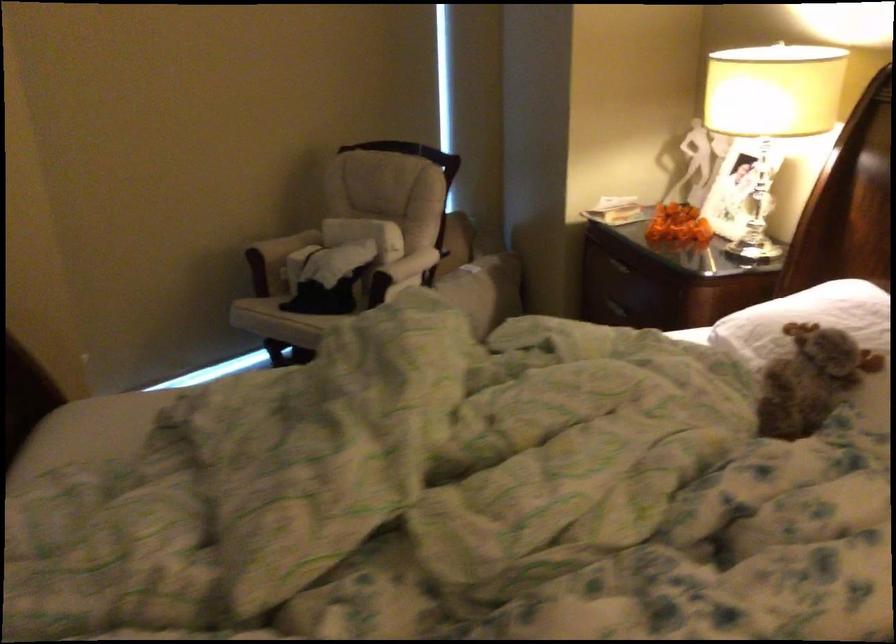
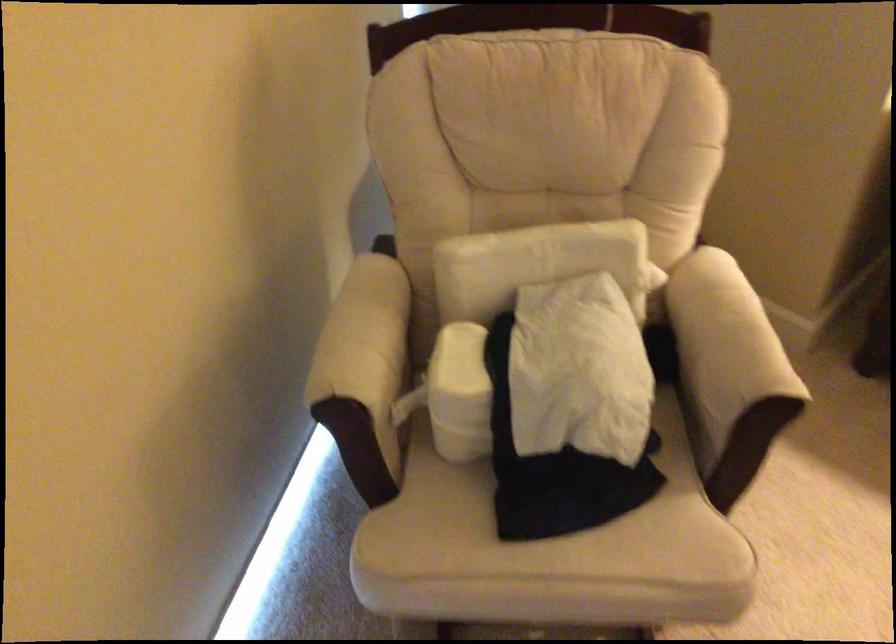
The point at (268, 245) is marked in the first image. Where is the corresponding point in the second image?

(364, 373)